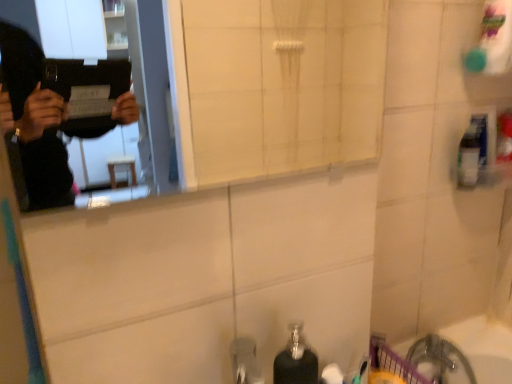
Measure the distance between white glossy mirror at upper center and camera.

white glossy mirror at upper center and camera are 5.29 feet apart from each other.

What do you see at coordinates (480, 337) in the screenshot?
I see `white plastic bath at lower right` at bounding box center [480, 337].

Identify the location of clear plastic bottle at upper right. The height and width of the screenshot is (384, 512). (470, 154).

Is point (469, 323) farther from viewer compared to point (462, 186)?

Yes, it is.

Is white plastic bath at lower right thinner than clear plastic bottle at upper right?

No, white plastic bath at lower right is not thinner than clear plastic bottle at upper right.

Can you see white plastic bath at lower right touching clear plastic bottle at upper right?

No, white plastic bath at lower right is not making contact with clear plastic bottle at upper right.

Is black matte soap dispenser at lower center situated inside white glossy mirror at upper center or outside?

The correct answer is: outside.

Does black matte soap dispenser at lower center have a lesser width compared to white glossy mirror at upper center?

In fact, black matte soap dispenser at lower center might be wider than white glossy mirror at upper center.

From a real-world perspective, does black matte soap dispenser at lower center sit lower than white glossy mirror at upper center?

Yes, from a real-world perspective, black matte soap dispenser at lower center is below white glossy mirror at upper center.

Which object is more forward, black matte soap dispenser at lower center or white glossy mirror at upper center?

white glossy mirror at upper center is more forward.

From a real-world perspective, does white plastic bath at lower right stand above black matte soap dispenser at lower center?

No, from a real-world perspective, white plastic bath at lower right is not above black matte soap dispenser at lower center.

Consider the image. Do you think white plastic bath at lower right is within black matte soap dispenser at lower center, or outside of it?

white plastic bath at lower right cannot be found inside black matte soap dispenser at lower center.

Does white plastic bath at lower right appear on the left side of black matte soap dispenser at lower center?

In fact, white plastic bath at lower right is to the right of black matte soap dispenser at lower center.

Find the location of a particular element. The height and width of the screenshot is (384, 512). mirror on the left side of white plastic bath at lower right is located at coordinates (280, 83).

From the picture: From the image's perspective, which is above, white glossy mirror at upper center or white plastic bath at lower right?

white glossy mirror at upper center appears higher in the image.

Is white glossy mirror at upper center facing away from white plastic bath at lower right?

That's not correct — white glossy mirror at upper center is not looking away from white plastic bath at lower right.

From a real-world perspective, is white glossy mirror at upper center located higher than white plastic bath at lower right?

Correct, in the physical world, white glossy mirror at upper center is higher than white plastic bath at lower right.

From the image's perspective, between white glossy mirror at upper center and black matte soap dispenser at lower center, who is located below?

From the image's view, black matte soap dispenser at lower center is below.

Considering the sizes of objects white glossy mirror at upper center and black matte soap dispenser at lower center in the image provided, who is thinner, white glossy mirror at upper center or black matte soap dispenser at lower center?

Thinner between the two is white glossy mirror at upper center.

Considering the relative sizes of white glossy mirror at upper center and black matte soap dispenser at lower center in the image provided, is white glossy mirror at upper center taller than black matte soap dispenser at lower center?

Correct, white glossy mirror at upper center is much taller as black matte soap dispenser at lower center.

Would you consider white glossy mirror at upper center to be distant from black matte soap dispenser at lower center?

Yes, white glossy mirror at upper center and black matte soap dispenser at lower center are quite far apart.

Is white plastic bath at lower right bigger than white glossy mirror at upper center?

Correct, white plastic bath at lower right is larger in size than white glossy mirror at upper center.

From the image's perspective, is white plastic bath at lower right located beneath white glossy mirror at upper center?

Correct, white plastic bath at lower right appears lower than white glossy mirror at upper center in the image.

From a real-world perspective, who is located higher, white plastic bath at lower right or white glossy mirror at upper center?

Answer: white glossy mirror at upper center, from a real-world perspective.

In the image, there is a white glossy mirror at upper center. At what (x,y) coordinates should I click in order to perform the action: click on bath below it (from the image's perspective). Please return your answer as a coordinate pair (x, y). Looking at the image, I should click on (480, 337).

From the image's perspective, is black matte soap dispenser at lower center positioned above or below white plastic bath at lower right?

black matte soap dispenser at lower center is situated higher than white plastic bath at lower right in the image.

At what (x,y) coordinates should I click in order to perform the action: click on soap dispenser above the white plastic bath at lower right (from a real-world perspective). Please return your answer as a coordinate pair (x, y). Looking at the image, I should click on (296, 360).

Is white plastic bath at lower right inside black matte soap dispenser at lower center?

That's incorrect, white plastic bath at lower right is not inside black matte soap dispenser at lower center.

Which is more to the left, black matte soap dispenser at lower center or white plastic bath at lower right?

black matte soap dispenser at lower center is more to the left.

The width and height of the screenshot is (512, 384). I want to click on bath lying on the left of clear plastic bottle at upper right, so click(480, 337).

Find the location of a particular element. This screenshot has height=384, width=512. soap dispenser located below the white glossy mirror at upper center (from the image's perspective) is located at coordinates (296, 360).

When comparing their distances from clear plastic bottle at upper right, does black matte soap dispenser at lower center or white glossy mirror at upper center seem closer?

black matte soap dispenser at lower center lies closer to clear plastic bottle at upper right than the other object.

Estimate the real-world distances between objects in this image. Which object is further from white glossy mirror at upper center, black matte soap dispenser at lower center or clear plastic bottle at upper right?

Among the two, black matte soap dispenser at lower center is located further to white glossy mirror at upper center.

Looking at the image, which one is located further to white glossy mirror at upper center, clear plastic bottle at upper right or black matte soap dispenser at lower center?

black matte soap dispenser at lower center is further to white glossy mirror at upper center.

Considering their positions, is clear plastic bottle at upper right positioned closer to black matte soap dispenser at lower center than white glossy mirror at upper center?

The object closer to black matte soap dispenser at lower center is clear plastic bottle at upper right.

Which object lies nearer to the anchor point white glossy mirror at upper center, white plastic bath at lower right or black matte soap dispenser at lower center?

white plastic bath at lower right.

When comparing their distances from white plastic bath at lower right, does clear plastic bottle at upper right or black matte soap dispenser at lower center seem further?

The object further to white plastic bath at lower right is black matte soap dispenser at lower center.

Considering their positions, is white glossy mirror at upper center positioned closer to clear plastic bottle at upper right than black matte soap dispenser at lower center?

Among the two, black matte soap dispenser at lower center is located nearer to clear plastic bottle at upper right.

Considering their positions, is white plastic bath at lower right positioned further to clear plastic bottle at upper right than white glossy mirror at upper center?

Among the two, white glossy mirror at upper center is located further to clear plastic bottle at upper right.

Find the location of a particular element. Image resolution: width=512 pixels, height=384 pixels. soap dispenser situated between white glossy mirror at upper center and clear plastic bottle at upper right from left to right is located at coordinates (296, 360).

Image resolution: width=512 pixels, height=384 pixels. Identify the location of mouthwash between white glossy mirror at upper center and white plastic bath at lower right vertically. (470, 154).

You are a GUI agent. You are given a task and a screenshot of the screen. Output one action in this format:
    pyautogui.click(x=<x>, y=<y>)
    Task: Click on the soap dispenser between white glossy mirror at upper center and white plastic bath at lower right vertically
    This screenshot has height=384, width=512.
    Given the screenshot: What is the action you would take?
    pyautogui.click(x=296, y=360)

Where is `soap dispenser that lies between clear plastic bottle at upper right and white plastic bath at lower right from top to bottom`? soap dispenser that lies between clear plastic bottle at upper right and white plastic bath at lower right from top to bottom is located at coordinates (296, 360).